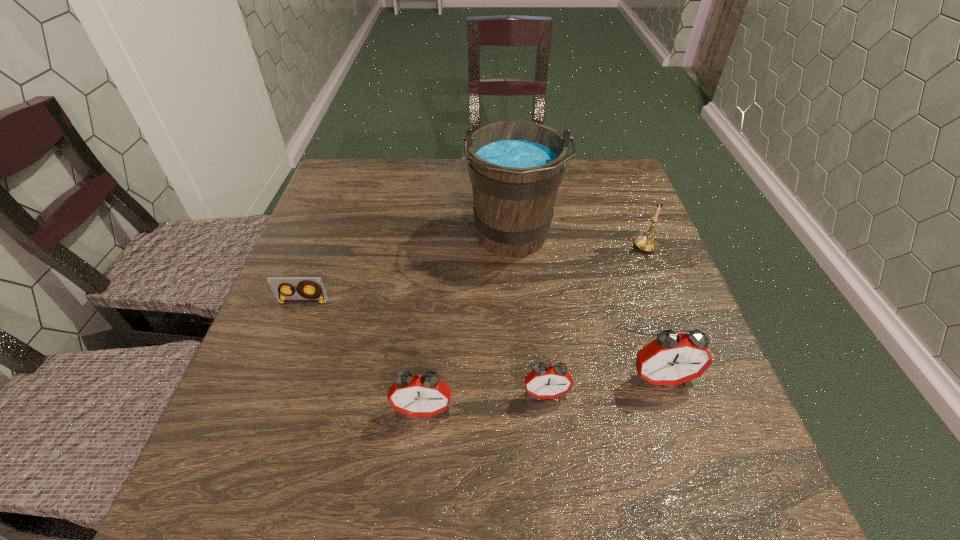
Locate an element on the screen. This screenshot has width=960, height=540. free space between the candle holder and the rightmost alarm clock is located at coordinates (654, 314).

This screenshot has width=960, height=540. I want to click on unoccupied area between the leftmost alarm clock and the fifth tallest object, so click(x=484, y=402).

You are a GUI agent. You are given a task and a screenshot of the screen. Output one action in this format:
    pyautogui.click(x=<x>, y=<y>)
    Task: Click on the free space between the second shortest alarm clock and the second shortest object
    This screenshot has height=540, width=960.
    Given the screenshot: What is the action you would take?
    pyautogui.click(x=484, y=402)

Where is `free space between the candle holder and the second tallest alarm clock`? The height and width of the screenshot is (540, 960). free space between the candle holder and the second tallest alarm clock is located at coordinates (535, 329).

Find the location of `free space between the third farthest object and the shortest alarm clock`. free space between the third farthest object and the shortest alarm clock is located at coordinates (424, 348).

Identify which object is located as the third nearest to the second alarm clock from right to left. Please provide its 2D coordinates. Your answer should be formatted as a tuple, i.e. [(x, y)], where the tuple contains the x and y coordinates of a point satisfying the conditions above.

[(516, 167)]

Locate which object is the fourth closest to the tallest alarm clock. Please provide its 2D coordinates. Your answer should be formatted as a tuple, i.e. [(x, y)], where the tuple contains the x and y coordinates of a point satisfying the conditions above.

[(425, 395)]

Identify which alarm clock is the closest to the wine bucket. Please provide its 2D coordinates. Your answer should be formatted as a tuple, i.e. [(x, y)], where the tuple contains the x and y coordinates of a point satisfying the conditions above.

[(671, 359)]

This screenshot has width=960, height=540. In order to click on alarm clock object that ranks as the second closest to the second shortest alarm clock in this screenshot , I will do [671, 359].